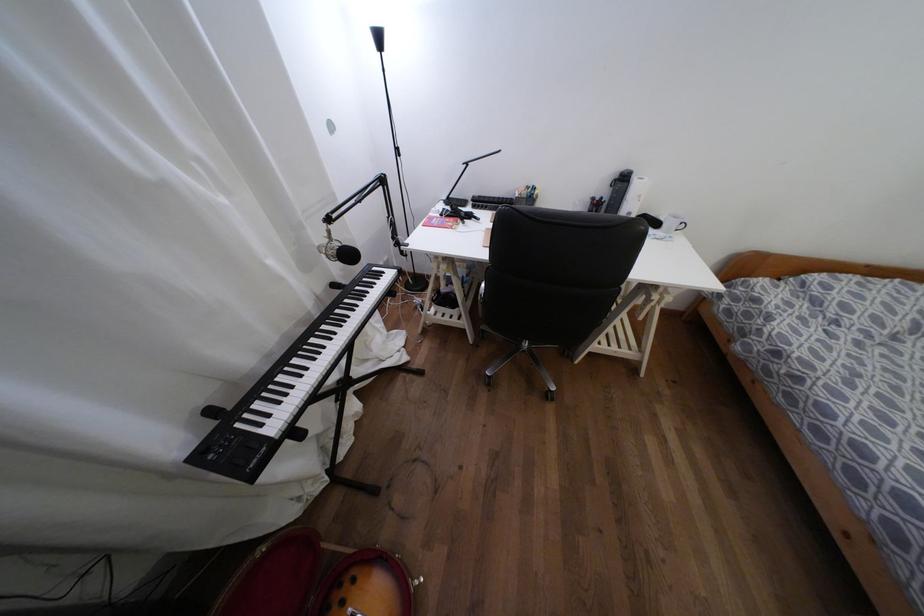
Find the location of a particular element. This screenshot has height=616, width=924. silver microphone is located at coordinates (338, 251).